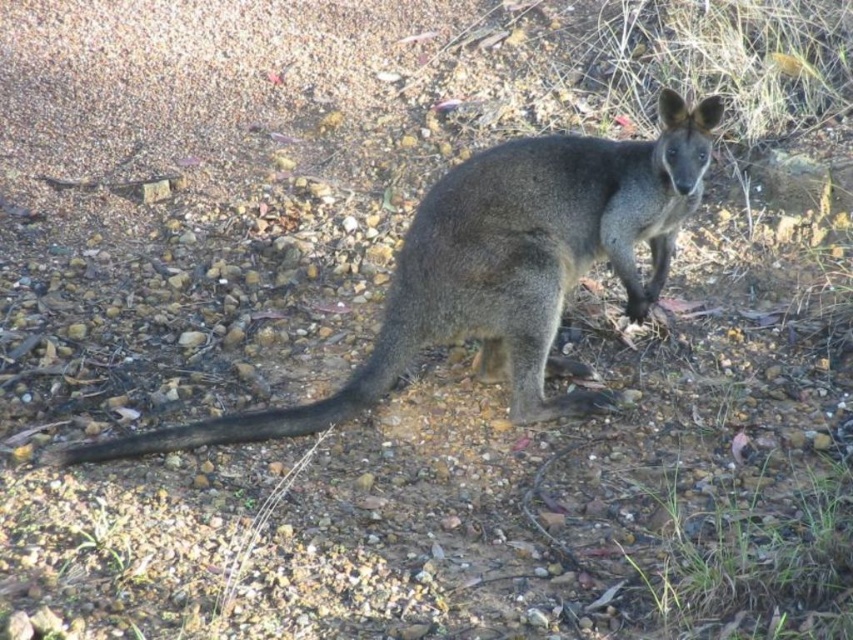
In the scene shown: Is gray fur kangaroo at center further to the viewer compared to black fur tail at center?

Yes, it is.

The image size is (853, 640). Describe the element at coordinates (502, 269) in the screenshot. I see `gray fur kangaroo at center` at that location.

Does point (514, 300) come in front of point (387, 356)?

Yes.

In order to click on gray fur kangaroo at center in this screenshot , I will do `click(502, 269)`.